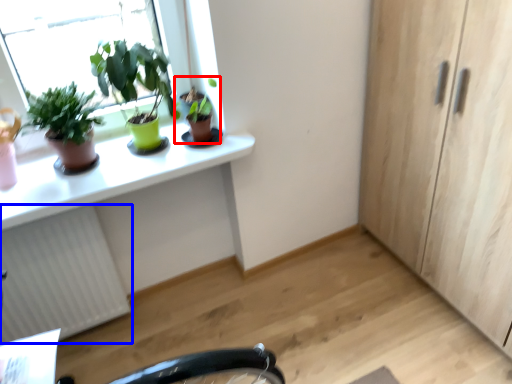
Question: Which of the following is the closest to the observer, houseplant (highlighted by a red box) or radiator (highlighted by a blue box)?

Choices:
 (A) houseplant
 (B) radiator

Answer: (B)